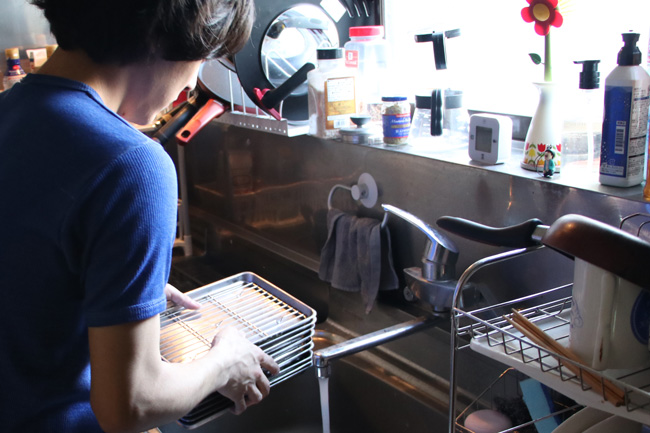
The height and width of the screenshot is (433, 650). Find the location of `drying rack`. drying rack is located at coordinates (513, 345).